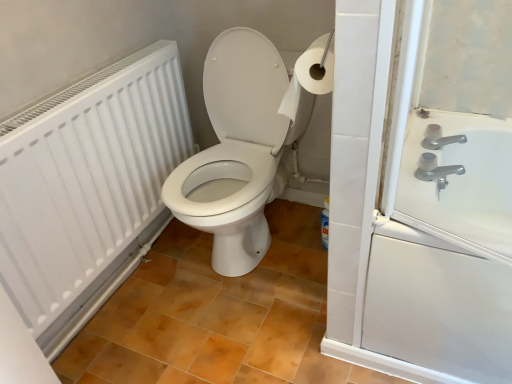
Question: Is white glossy toilet at center in front of or behind white matte radiator at left in the image?

Choices:
 (A) front
 (B) behind

Answer: (B)

Question: Considering the relative positions of white glossy toilet at center and white matte radiator at left in the image provided, is white glossy toilet at center to the left or to the right of white matte radiator at left?

Choices:
 (A) right
 (B) left

Answer: (A)

Question: Which object is the closest to the satin nickel faucet at upper right?

Choices:
 (A) white glossy toilet at center
 (B) white matte radiator at left
 (C) white paper at upper right

Answer: (C)

Question: Estimate the real-world distances between objects in this image. Which object is farther from the white paper at upper right?

Choices:
 (A) white glossy toilet at center
 (B) satin nickel faucet at upper right
 (C) white matte radiator at left

Answer: (C)